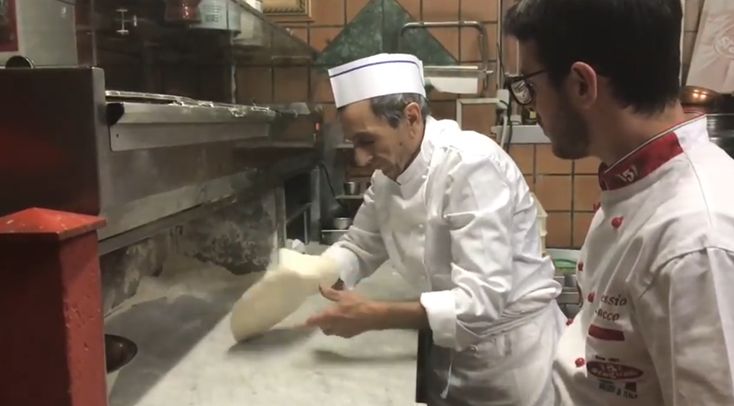
Locate an element on the screen. This screenshot has width=734, height=406. metal bowl is located at coordinates (119, 355).